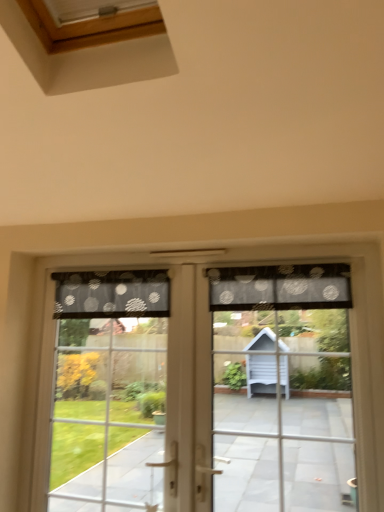
What do you see at coordinates (282, 387) in the screenshot? The width and height of the screenshot is (384, 512). I see `translucent polka dot curtain at center` at bounding box center [282, 387].

Describe the element at coordinates (214, 386) in the screenshot. I see `transparent fabric at center` at that location.

Locate an element on the screen. translucent polka dot curtain at center is located at coordinates (282, 387).

Considering the points (243, 273) and (54, 274), which point is in front, point (243, 273) or point (54, 274)?

The point (243, 273) is more forward.

From their relative heights in the image, would you say black dotted fabric at upper center, which is the 2th curtain in left-to-right order, is taller or shorter than black dotted fabric at upper center, the second curtain when ordered from right to left?

In the image, black dotted fabric at upper center, which is the 2th curtain in left-to-right order, appears to be shorter than black dotted fabric at upper center, the second curtain when ordered from right to left.

How different are the orientations of black dotted fabric at upper center, the first curtain when ordered from right to left, and black dotted fabric at upper center, the second curtain when ordered from right to left, in degrees?

0.000959 degrees.

Between black dotted fabric at upper center, which is the 2th curtain in left-to-right order, and black dotted fabric at upper center, the second curtain when ordered from right to left, which one has larger width?

With larger width is black dotted fabric at upper center, the second curtain when ordered from right to left.

Would you say transparent fabric at center is outside black dotted fabric at upper center, the second curtain when ordered from right to left?

Indeed, transparent fabric at center is completely outside black dotted fabric at upper center, the second curtain when ordered from right to left.

Who is shorter, transparent fabric at center or black dotted fabric at upper center, the second curtain when ordered from right to left?

With less height is black dotted fabric at upper center, the second curtain when ordered from right to left.

Considering the sizes of objects transparent fabric at center and black dotted fabric at upper center, acting as the first curtain starting from the left, in the image provided, who is bigger, transparent fabric at center or black dotted fabric at upper center, acting as the first curtain starting from the left,?

transparent fabric at center is bigger.

Is transparent fabric at center to the left or to the right of black dotted fabric at upper center, the second curtain when ordered from right to left, in the image?

transparent fabric at center is to the right of black dotted fabric at upper center, the second curtain when ordered from right to left.

Which object is positioned more to the right, black dotted fabric at upper center, the second curtain when ordered from right to left, or black dotted fabric at upper center, the first curtain when ordered from right to left?

black dotted fabric at upper center, the first curtain when ordered from right to left, is more to the right.

Between point (120, 301) and point (326, 305), which one is positioned in front?

The point (326, 305) is in front.

In the image, is black dotted fabric at upper center, acting as the first curtain starting from the left, positioned in front of or behind black dotted fabric at upper center, which is the 2th curtain in left-to-right order?

Visually, black dotted fabric at upper center, acting as the first curtain starting from the left, is located behind black dotted fabric at upper center, which is the 2th curtain in left-to-right order.

Is black dotted fabric at upper center, the second curtain when ordered from right to left, shorter than black dotted fabric at upper center, which is the 2th curtain in left-to-right order?

Incorrect, the height of black dotted fabric at upper center, the second curtain when ordered from right to left, does not fall short of that of black dotted fabric at upper center, which is the 2th curtain in left-to-right order.

Is point (300, 305) farther from viewer compared to point (93, 422)?

No, it is not.

What's the angular difference between black dotted fabric at upper center, which is the 2th curtain in left-to-right order, and translucent fabric curtain at left's facing directions?

The angle between the facing direction of black dotted fabric at upper center, which is the 2th curtain in left-to-right order, and the facing direction of translucent fabric curtain at left is 0.00225 degrees.

Is black dotted fabric at upper center, the first curtain when ordered from right to left, located outside translucent fabric curtain at left?

Absolutely, black dotted fabric at upper center, the first curtain when ordered from right to left, is external to translucent fabric curtain at left.

Between black dotted fabric at upper center, which is the 2th curtain in left-to-right order, and translucent fabric curtain at left, which one has larger size?

With larger size is translucent fabric curtain at left.

Considering the positions of objects black dotted fabric at upper center, acting as the first curtain starting from the left, and transparent fabric at center in the image provided, who is more to the right, black dotted fabric at upper center, acting as the first curtain starting from the left, or transparent fabric at center?

From the viewer's perspective, transparent fabric at center appears more on the right side.

Does black dotted fabric at upper center, acting as the first curtain starting from the left, have a lesser height compared to transparent fabric at center?

Yes.

Considering the sizes of objects black dotted fabric at upper center, the second curtain when ordered from right to left, and transparent fabric at center in the image provided, who is bigger, black dotted fabric at upper center, the second curtain when ordered from right to left, or transparent fabric at center?

transparent fabric at center is bigger.

From the image's perspective, is black dotted fabric at upper center, the second curtain when ordered from right to left, over transparent fabric at center?

Yes.

What are the coordinates of `the 1st curtain above the translucent polka dot curtain at center (from the image's perspective)` in the screenshot? It's located at (112, 294).

Can you confirm if translucent polka dot curtain at center is smaller than black dotted fabric at upper center, acting as the first curtain starting from the left?

No.

Which object is further away from the camera, translucent polka dot curtain at center or black dotted fabric at upper center, acting as the first curtain starting from the left?

black dotted fabric at upper center, acting as the first curtain starting from the left, is further away from the camera.

Is translucent polka dot curtain at center wider than black dotted fabric at upper center, acting as the first curtain starting from the left?

Correct, the width of translucent polka dot curtain at center exceeds that of black dotted fabric at upper center, acting as the first curtain starting from the left.

Is black dotted fabric at upper center, acting as the first curtain starting from the left, bigger or smaller than translucent polka dot curtain at center?

In the image, black dotted fabric at upper center, acting as the first curtain starting from the left, appears to be smaller than translucent polka dot curtain at center.

Which of these two, black dotted fabric at upper center, the second curtain when ordered from right to left, or translucent polka dot curtain at center, is thinner?

black dotted fabric at upper center, the second curtain when ordered from right to left, is thinner.

Locate an element on the screen. The image size is (384, 512). screen door on the right side of black dotted fabric at upper center, acting as the first curtain starting from the left is located at coordinates (282, 387).

Locate an element on the screen. This screenshot has width=384, height=512. curtain lying behind the black dotted fabric at upper center, the first curtain when ordered from right to left is located at coordinates tap(112, 294).

From the image's perspective, starting from the transparent fabric at center, which curtain is the 1st one above? Please provide its 2D coordinates.

[(112, 294)]

When comparing their distances from translucent fabric curtain at left, does transparent fabric at center or black dotted fabric at upper center, acting as the first curtain starting from the left, seem closer?

Among the two, transparent fabric at center is located nearer to translucent fabric curtain at left.

Based on their spatial positions, is transparent fabric at center or black dotted fabric at upper center, which is the 2th curtain in left-to-right order, further from black dotted fabric at upper center, acting as the first curtain starting from the left?

black dotted fabric at upper center, which is the 2th curtain in left-to-right order.

Which object lies further to the anchor point black dotted fabric at upper center, the first curtain when ordered from right to left, black dotted fabric at upper center, acting as the first curtain starting from the left, or transparent fabric at center?

The object further to black dotted fabric at upper center, the first curtain when ordered from right to left, is black dotted fabric at upper center, acting as the first curtain starting from the left.

When comparing their distances from translucent fabric curtain at left, does black dotted fabric at upper center, the first curtain when ordered from right to left, or black dotted fabric at upper center, acting as the first curtain starting from the left, seem closer?

Among the two, black dotted fabric at upper center, acting as the first curtain starting from the left, is located nearer to translucent fabric curtain at left.

Considering their positions, is translucent fabric curtain at left positioned further to translucent polka dot curtain at center than black dotted fabric at upper center, which is the 2th curtain in left-to-right order?

translucent fabric curtain at left is further to translucent polka dot curtain at center.

When comparing their distances from transparent fabric at center, does translucent polka dot curtain at center or black dotted fabric at upper center, the second curtain when ordered from right to left, seem further?

black dotted fabric at upper center, the second curtain when ordered from right to left, lies further to transparent fabric at center than the other object.

Based on their spatial positions, is black dotted fabric at upper center, the first curtain when ordered from right to left, or transparent fabric at center further from black dotted fabric at upper center, acting as the first curtain starting from the left?

black dotted fabric at upper center, the first curtain when ordered from right to left, is further to black dotted fabric at upper center, acting as the first curtain starting from the left.

Estimate the real-world distances between objects in this image. Which object is closer to black dotted fabric at upper center, the second curtain when ordered from right to left, translucent polka dot curtain at center or black dotted fabric at upper center, which is the 2th curtain in left-to-right order?

black dotted fabric at upper center, which is the 2th curtain in left-to-right order, lies closer to black dotted fabric at upper center, the second curtain when ordered from right to left, than the other object.

The width and height of the screenshot is (384, 512). I want to click on window situated between translucent fabric curtain at left and black dotted fabric at upper center, which is the 2th curtain in left-to-right order, from left to right, so click(x=214, y=386).

What are the coordinates of `window between black dotted fabric at upper center, the second curtain when ordered from right to left, and translucent fabric curtain at left vertically` in the screenshot? It's located at (214, 386).

Locate an element on the screen. The image size is (384, 512). bay window between black dotted fabric at upper center, acting as the first curtain starting from the left, and black dotted fabric at upper center, the first curtain when ordered from right to left is located at coordinates (108, 388).

The height and width of the screenshot is (512, 384). Identify the location of screen door between black dotted fabric at upper center, the second curtain when ordered from right to left, and black dotted fabric at upper center, which is the 2th curtain in left-to-right order. (282, 387).